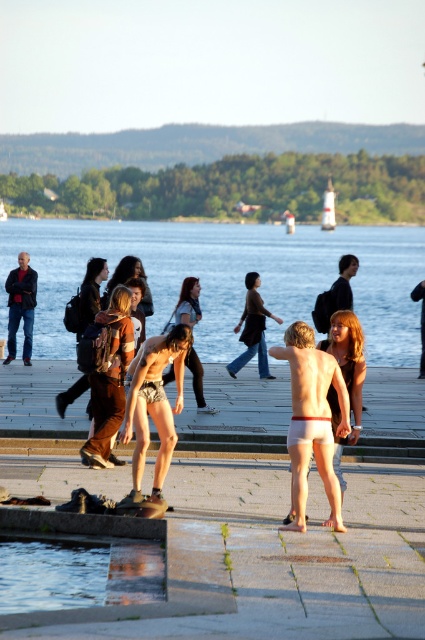
Who is positioned more to the left, clear blue water at center or white fabric shorts at center?

clear blue water at center

Is point (166, 228) farther from viewer compared to point (297, 436)?

Yes, point (166, 228) is farther from viewer.

At what (x,y) coordinates should I click in order to perform the action: click on clear blue water at center. Please return your answer as a coordinate pair (x, y). The image size is (425, 640). Looking at the image, I should click on (226, 276).

At what (x,y) coordinates should I click in order to perform the action: click on clear blue water at center. Please return your answer as a coordinate pair (x, y). Image resolution: width=425 pixels, height=640 pixels. Looking at the image, I should click on (226, 276).

Who is higher up, clear blue water at center or matte black shorts at center?

Positioned higher is clear blue water at center.

Who is more forward, (212, 333) or (190, 355)?

Point (190, 355)

Where is `clear blue water at center`? clear blue water at center is located at coordinates (226, 276).

Is white concrete dock at center positioned behind white matte bikini top at center?

Yes, white concrete dock at center is behind white matte bikini top at center.

Which is above, white concrete dock at center or white matte bikini top at center?

white matte bikini top at center is above.

Is point (402, 438) closer to viewer compared to point (300, 323)?

No, (402, 438) is further to viewer.

Find the location of a particular element. The height and width of the screenshot is (640, 425). white concrete dock at center is located at coordinates (238, 412).